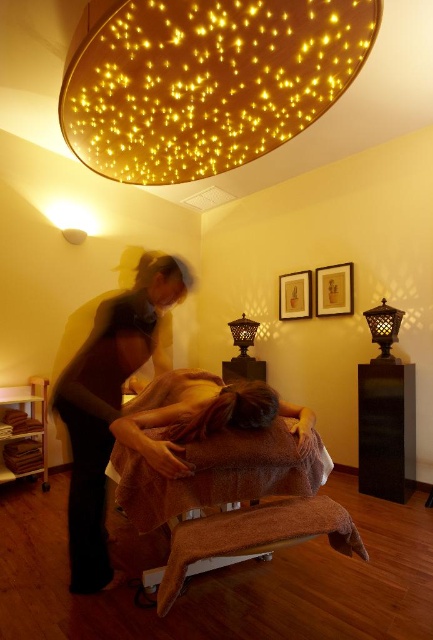
Which is more to the left, illuminated fiber optic ceiling at upper center or brown soft pillow at lower center?

Positioned to the left is illuminated fiber optic ceiling at upper center.

Can you confirm if illuminated fiber optic ceiling at upper center is shorter than brown soft pillow at lower center?

A: No.

Which is in front, point (139, 17) or point (278, 436)?

Point (139, 17)

Image resolution: width=433 pixels, height=640 pixels. What are the coordinates of `illuminated fiber optic ceiling at upper center` in the screenshot? It's located at coord(204,81).

Who is lower down, smooth beige towel at center or brown towel at center?

smooth beige towel at center is lower down.

Between point (123, 294) and point (236, 396), which one is positioned in front?

Point (236, 396)

The image size is (433, 640). What do you see at coordinates (107, 404) in the screenshot?
I see `smooth beige towel at center` at bounding box center [107, 404].

Find the location of a particular element. The image size is (433, 640). smooth beige towel at center is located at coordinates (107, 404).

Which is in front, point (145, 253) or point (235, 340)?

Point (145, 253) is more forward.

Is smooth beige towel at center above matte black lantern at center?

Actually, smooth beige towel at center is below matte black lantern at center.

Between point (158, 280) and point (254, 321), which one is positioned in front?

Point (158, 280) is in front.

Identify the location of smooth beige towel at center. (107, 404).